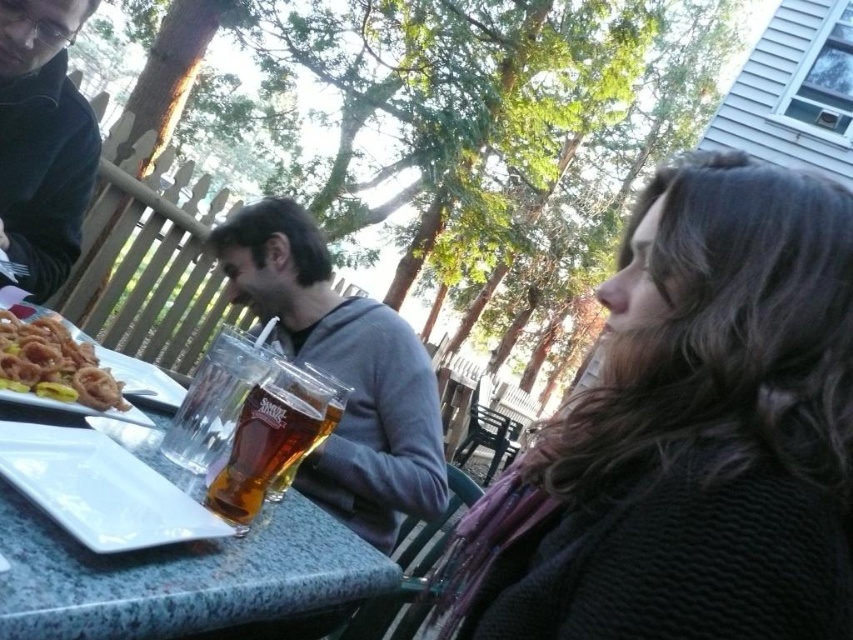
Does dark brown hair at right have a greater width compared to dark gray sweater at upper left?

Correct, the width of dark brown hair at right exceeds that of dark gray sweater at upper left.

Image resolution: width=853 pixels, height=640 pixels. In order to click on dark brown hair at right in this screenshot , I will do `click(691, 433)`.

You are a GUI agent. You are given a task and a screenshot of the screen. Output one action in this format:
    pyautogui.click(x=<x>, y=<y>)
    Task: Click on the dark brown hair at right
    Image resolution: width=853 pixels, height=640 pixels.
    Given the screenshot: What is the action you would take?
    pyautogui.click(x=691, y=433)

Which is in front, point (271, 604) or point (67, 452)?

Positioned in front is point (271, 604).

Consider the image. Does granite table at center have a lesser width compared to white glossy platter at lower left?

In fact, granite table at center might be wider than white glossy platter at lower left.

This screenshot has height=640, width=853. What are the coordinates of `granite table at center` in the screenshot? It's located at point(178,577).

Between point (53, 241) and point (80, 371), which one is positioned behind?

Positioned behind is point (53, 241).

Between point (93, 115) and point (59, 333), which one is positioned in front?

Positioned in front is point (59, 333).

Which is behind, point (24, 259) or point (93, 406)?

The point (24, 259) is behind.

This screenshot has width=853, height=640. Identify the location of dark gray sweater at upper left. (42, 140).